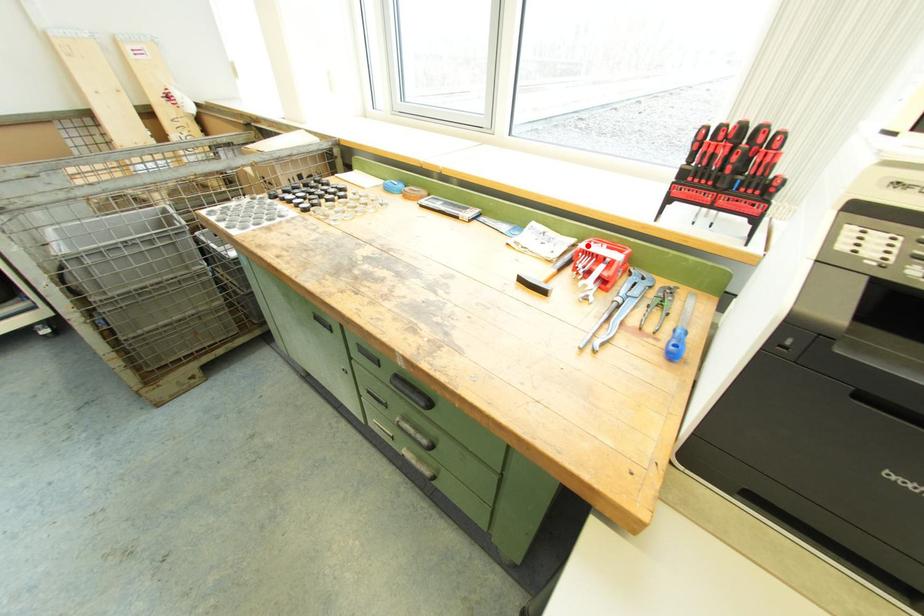
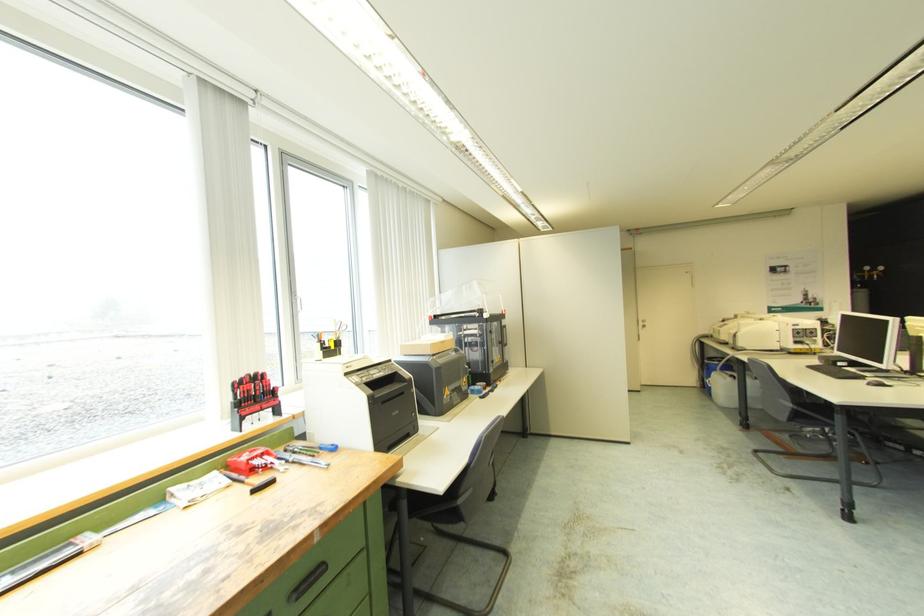
Find the pixel in the second image that matches the highlighted location in the first image.

(248, 458)